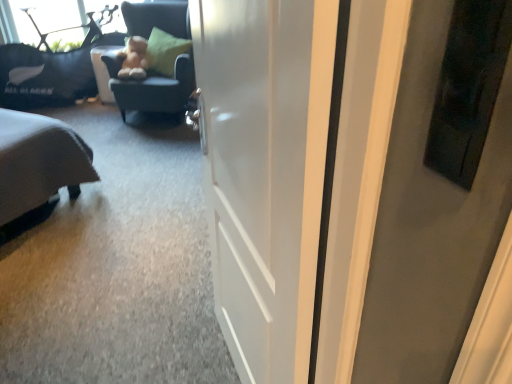
Question: Should I look upward or downward to see white glossy door at center?

Choices:
 (A) up
 (B) down

Answer: (B)

Question: Considering the relative sizes of dark blue fabric chair at upper left and fuzzy brown teddy bear at upper center in the image provided, is dark blue fabric chair at upper left taller than fuzzy brown teddy bear at upper center?

Choices:
 (A) yes
 (B) no

Answer: (A)

Question: From a real-world perspective, is dark blue fabric chair at upper left located higher than fuzzy brown teddy bear at upper center?

Choices:
 (A) no
 (B) yes

Answer: (A)

Question: Is dark blue fabric chair at upper left wider than fuzzy brown teddy bear at upper center?

Choices:
 (A) yes
 (B) no

Answer: (A)

Question: Is dark blue fabric chair at upper left smaller than fuzzy brown teddy bear at upper center?

Choices:
 (A) yes
 (B) no

Answer: (B)

Question: Is dark blue fabric chair at upper left further to the viewer compared to fuzzy brown teddy bear at upper center?

Choices:
 (A) yes
 (B) no

Answer: (B)

Question: Would you consider dark blue fabric chair at upper left to be distant from fuzzy brown teddy bear at upper center?

Choices:
 (A) no
 (B) yes

Answer: (A)

Question: Can you confirm if white glossy door at center is positioned to the left of dark blue fabric chair at upper left?

Choices:
 (A) yes
 (B) no

Answer: (B)

Question: Are white glossy door at center and dark blue fabric chair at upper left beside each other?

Choices:
 (A) yes
 (B) no

Answer: (B)

Question: Is white glossy door at center positioned before dark blue fabric chair at upper left?

Choices:
 (A) no
 (B) yes

Answer: (B)

Question: Is white glossy door at center not close to dark blue fabric chair at upper left?

Choices:
 (A) no
 (B) yes

Answer: (B)

Question: Is white glossy door at center taller than dark blue fabric chair at upper left?

Choices:
 (A) no
 (B) yes

Answer: (B)

Question: Can dark blue fabric chair at upper left be found inside white glossy door at center?

Choices:
 (A) yes
 (B) no

Answer: (B)

Question: Is white glossy door at center outside fuzzy brown teddy bear at upper center?

Choices:
 (A) no
 (B) yes

Answer: (B)